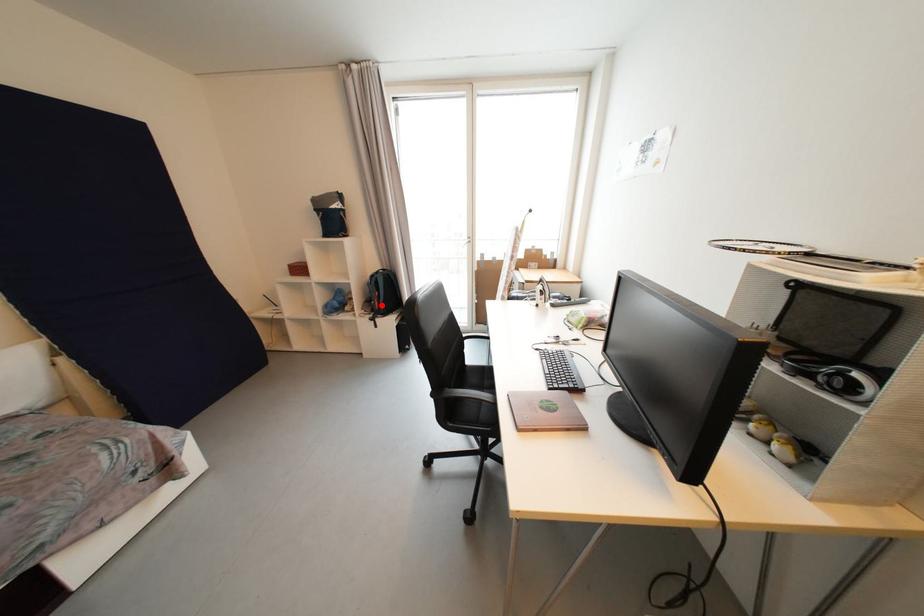
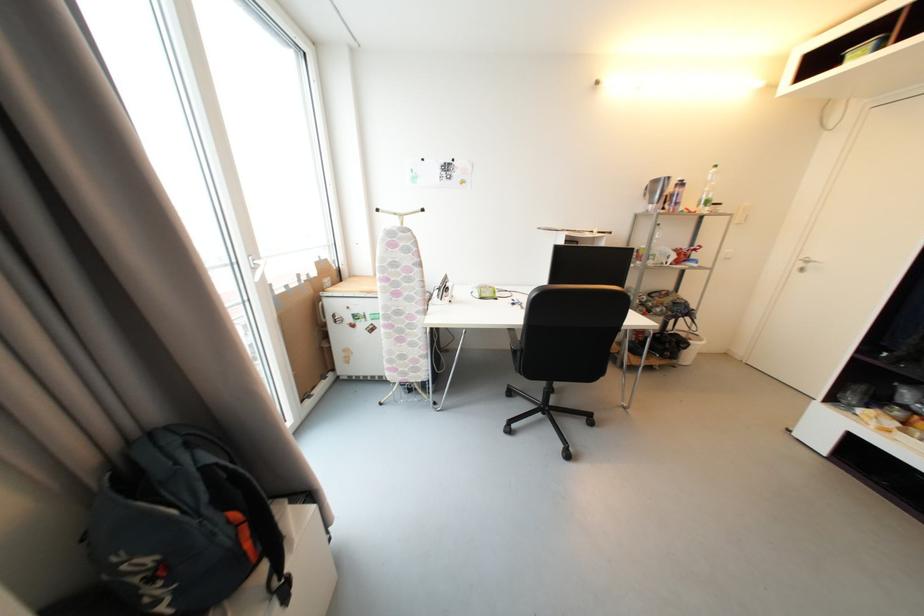
Question: A red point is marked in image1. In image2, is the corresponding 3D point closer to the camera or farther? Reply with the corresponding letter.

Choices:
 (A) The corresponding 3D point is closer.
 (B) The corresponding 3D point is farther.

Answer: (B)